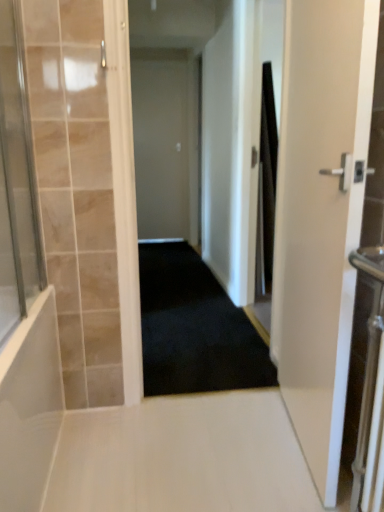
Question: Should I look upward or downward to see white glossy floor at center?

Choices:
 (A) up
 (B) down

Answer: (B)

Question: From the image's perspective, would you say transparent glass shower door at left is shown under black carpet at center?

Choices:
 (A) yes
 (B) no

Answer: (B)

Question: Does transparent glass shower door at left come behind black carpet at center?

Choices:
 (A) no
 (B) yes

Answer: (A)

Question: Is transparent glass shower door at left aimed at black carpet at center?

Choices:
 (A) no
 (B) yes

Answer: (A)

Question: Does transparent glass shower door at left have a larger size compared to black carpet at center?

Choices:
 (A) yes
 (B) no

Answer: (B)

Question: Is transparent glass shower door at left in front of black carpet at center?

Choices:
 (A) no
 (B) yes

Answer: (B)

Question: Can you confirm if transparent glass shower door at left is shorter than black carpet at center?

Choices:
 (A) no
 (B) yes

Answer: (A)

Question: Is the depth of white matte door at center, placed as the 1th door when sorted from left to right, greater than that of white glossy door at right, placed as the first door when sorted from right to left?

Choices:
 (A) yes
 (B) no

Answer: (A)

Question: Is white matte door at center, which ranks as the 2th door in right-to-left order, positioned beyond the bounds of white glossy door at right, the 2th door positioned from the left?

Choices:
 (A) no
 (B) yes

Answer: (B)

Question: Considering the relative sizes of white matte door at center, which ranks as the 2th door in right-to-left order, and white glossy door at right, the 2th door positioned from the left, in the image provided, is white matte door at center, which ranks as the 2th door in right-to-left order, taller than white glossy door at right, the 2th door positioned from the left,?

Choices:
 (A) yes
 (B) no

Answer: (A)

Question: From a real-world perspective, is white matte door at center, which ranks as the 2th door in right-to-left order, on top of white glossy door at right, acting as the 2th door starting from the back?

Choices:
 (A) no
 (B) yes

Answer: (B)

Question: Can you confirm if white matte door at center, which ranks as the 1th door in back-to-front order, is smaller than white glossy door at right, placed as the first door when sorted from right to left?

Choices:
 (A) yes
 (B) no

Answer: (A)

Question: Would you say white matte door at center, which appears as the 2th door when viewed from the front, contains white glossy door at right, the 2th door positioned from the left?

Choices:
 (A) no
 (B) yes

Answer: (A)

Question: From a real-world perspective, is white matte door at center, which ranks as the 2th door in right-to-left order, over black carpet at center?

Choices:
 (A) no
 (B) yes

Answer: (B)